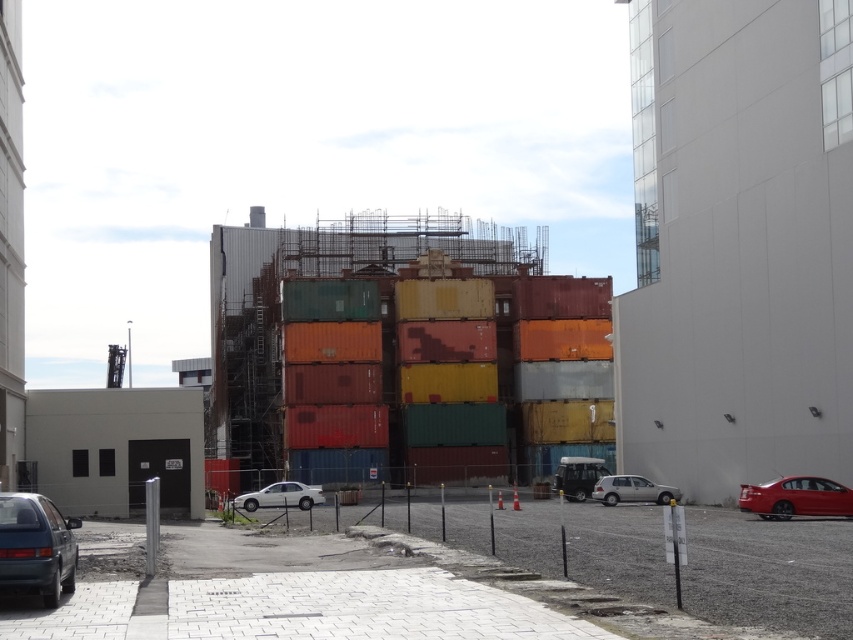
You are a delivery driver who needs to park your vehicle in this area. You see the matte gray hatchback at lower left and the satin silver car at lower right. Which vehicle takes up less space in the parking spot?

The matte gray hatchback at lower left takes up less space in the parking spot because it has a smaller size compared to the satin silver car at lower right.

You are driving a car and want to park between the matte gray hatchback at lower left and the satin silver car at lower right. Which side of the parking space should you choose to ensure you are between them?

You should park to the right side of the matte gray hatchback at lower left and to the left side of the satin silver car at lower right since the matte gray hatchback at lower left is positioned to the left of the satin silver car at lower right.